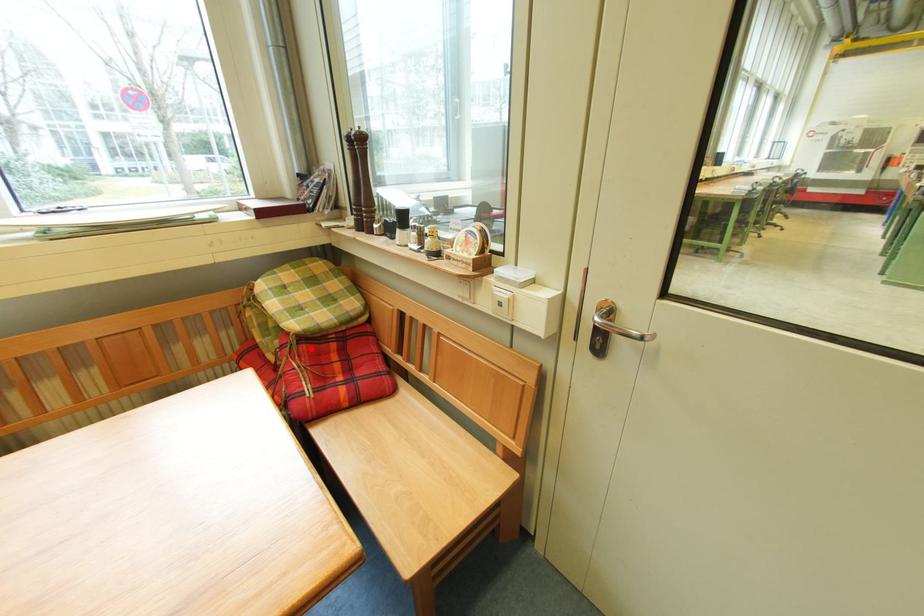
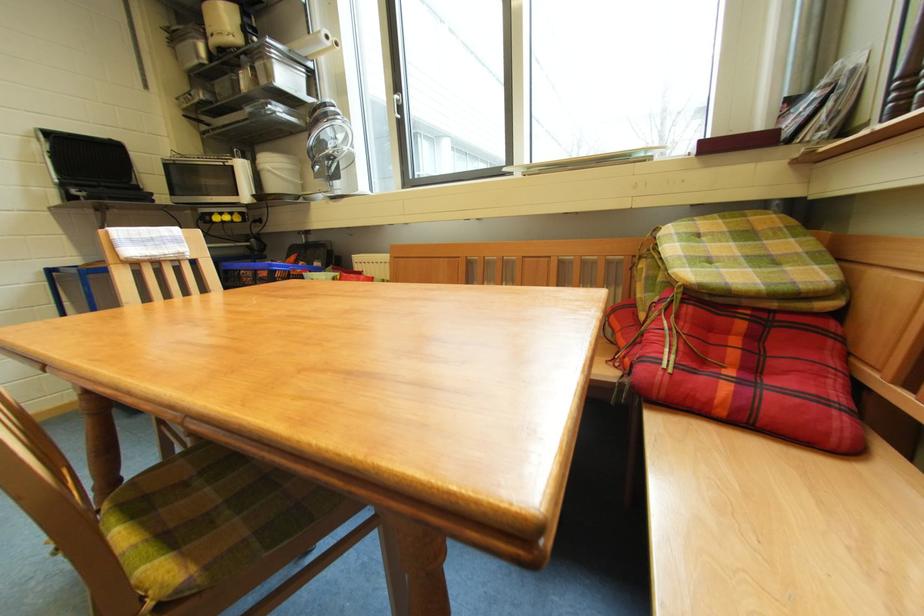
Locate, in the second image, the point that corresponds to the highlighted location in the first image.

(698, 310)